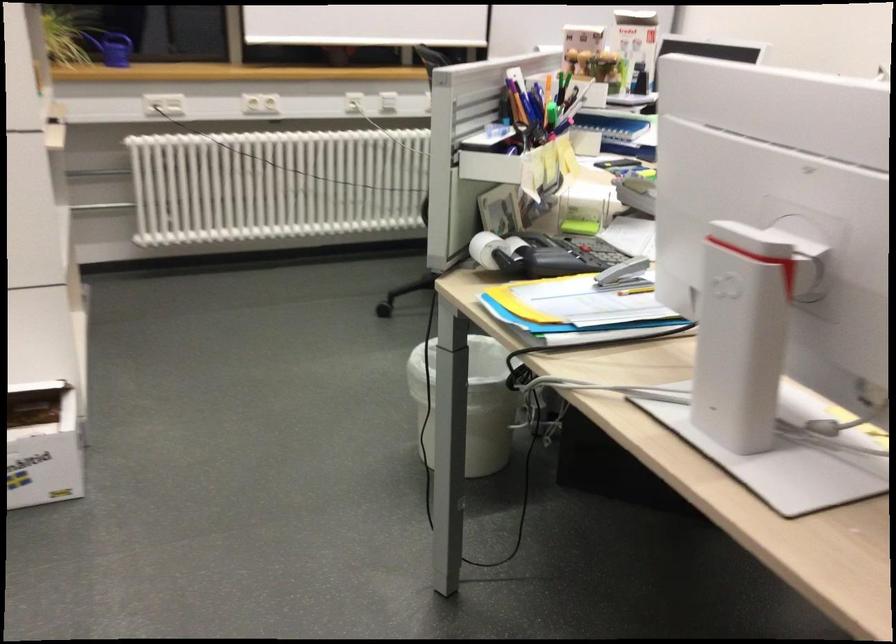
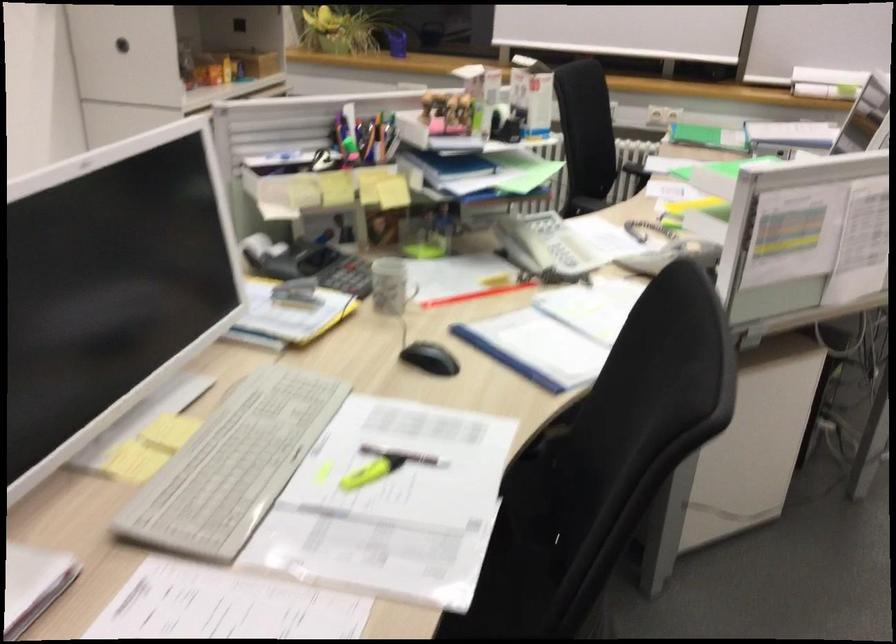
Question: I am providing you with two images of the same scene from different viewpoints. Please identify which objects are invisible in image2.

Choices:
 (A) white trash can
 (B) red pencil
 (C) round cabinet handle
 (D) blue step stool

Answer: (A)